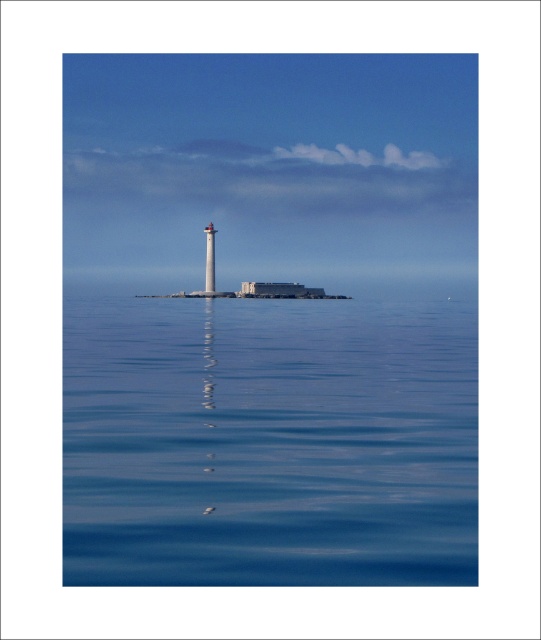
Question: Which point is farther to the camera?

Choices:
 (A) white glossy lighthouse at center
 (B) smooth blue water at center

Answer: (A)

Question: Among these objects, which one is nearest to the camera?

Choices:
 (A) white glossy lighthouse at center
 (B) smooth blue water at center

Answer: (B)

Question: Is smooth blue water at center further to the viewer compared to white glossy lighthouse at center?

Choices:
 (A) no
 (B) yes

Answer: (A)

Question: Can you confirm if smooth blue water at center is smaller than white glossy lighthouse at center?

Choices:
 (A) no
 (B) yes

Answer: (A)

Question: Is smooth blue water at center wider than white glossy lighthouse at center?

Choices:
 (A) no
 (B) yes

Answer: (B)

Question: Which point is farther to the camera?

Choices:
 (A) white glossy lighthouse at center
 (B) smooth blue water at center

Answer: (A)